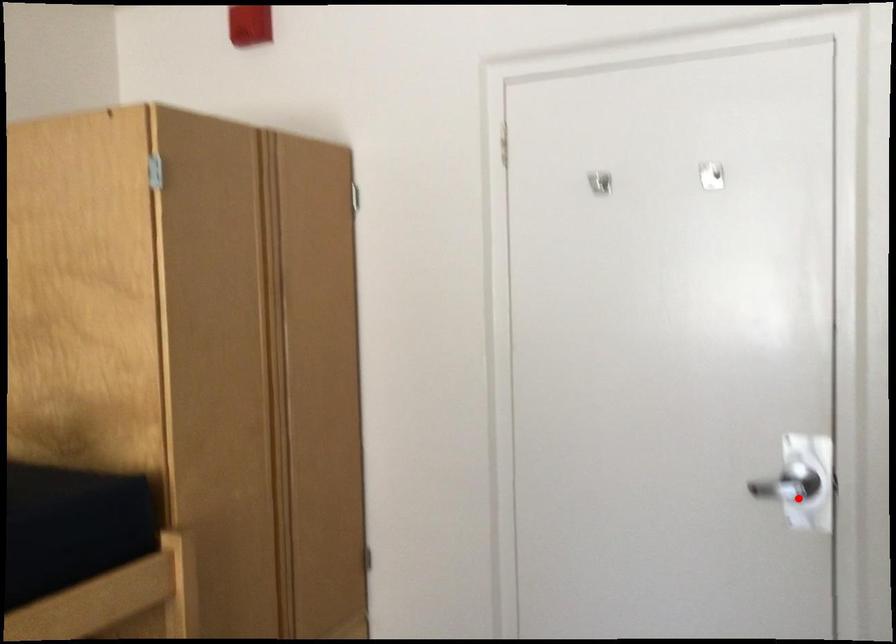
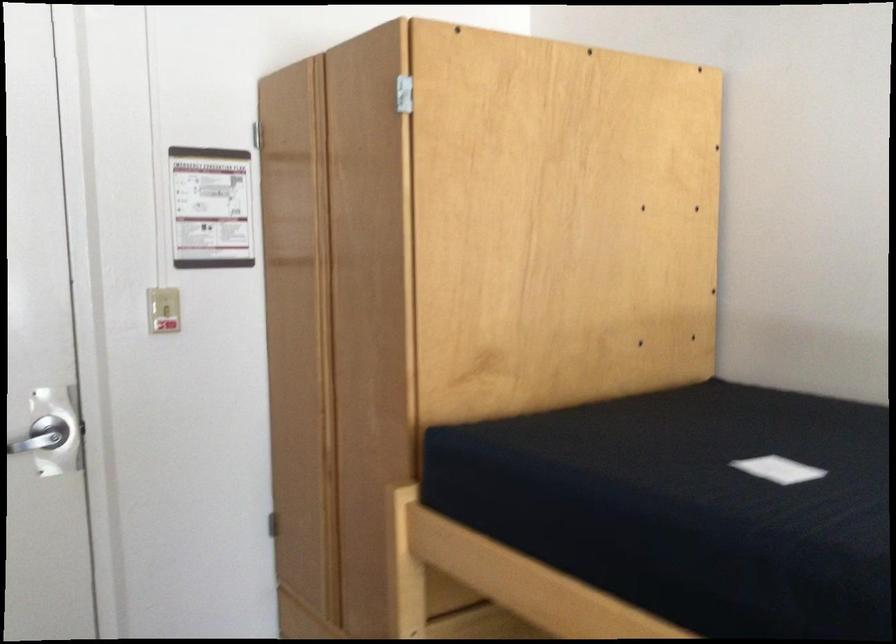
The point at the highlighted location is marked in the first image. Where is the corresponding point in the second image?

(47, 440)